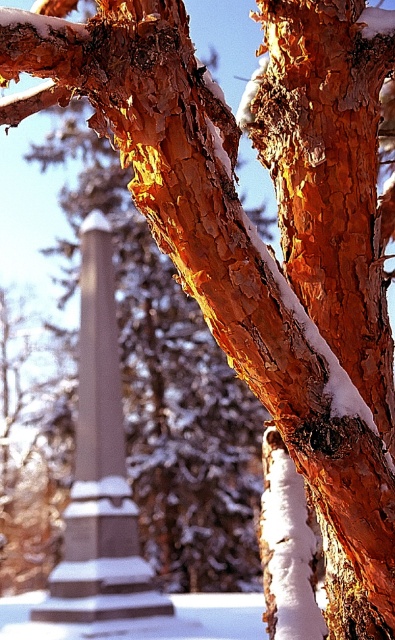
Is orange bark tree trunk at center shorter than smooth gray stone column at center?

Yes, orange bark tree trunk at center is shorter than smooth gray stone column at center.

Between point (338, 218) and point (79, 490), which one is positioned in front?

Point (338, 218) is more forward.

The image size is (395, 640). Describe the element at coordinates (331, 177) in the screenshot. I see `orange bark tree trunk at center` at that location.

Locate an element on the screen. The width and height of the screenshot is (395, 640). orange bark tree trunk at center is located at coordinates (331, 177).